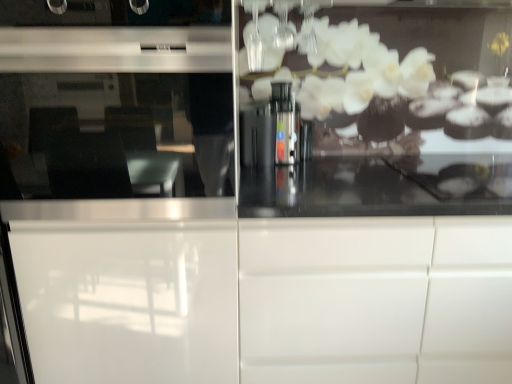
Question: Looking at the image, does white glossy cabinet at center seem bigger or smaller compared to white glossy screen door at center?

Choices:
 (A) small
 (B) big

Answer: (A)

Question: Is white glossy cabinet at center taller or shorter than white glossy screen door at center?

Choices:
 (A) tall
 (B) short

Answer: (B)

Question: Does point (331, 248) appear closer or farther from the camera than point (115, 306)?

Choices:
 (A) farther
 (B) closer

Answer: (B)

Question: From a real-world perspective, is white glossy screen door at center above or below white glossy cabinet at center?

Choices:
 (A) above
 (B) below

Answer: (A)

Question: From their relative heights in the image, would you say white glossy screen door at center is taller or shorter than white glossy cabinet at center?

Choices:
 (A) tall
 (B) short

Answer: (A)

Question: In the image, is white glossy screen door at center on the left side or the right side of white glossy cabinet at center?

Choices:
 (A) left
 (B) right

Answer: (A)

Question: Does point (176, 344) appear closer or farther from the camera than point (389, 226)?

Choices:
 (A) closer
 (B) farther

Answer: (B)